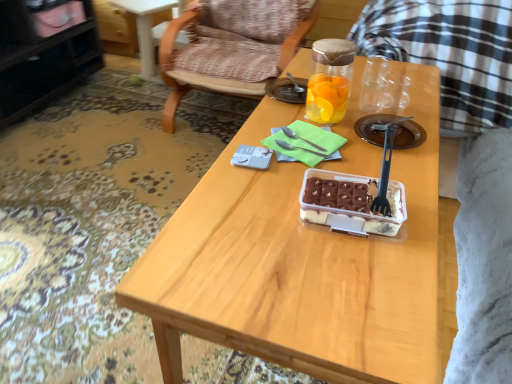
Find the location of a particular element. The width and height of the screenshot is (512, 384). vacant space positioned to the left of black plastic fork at center, the 3th fork when ordered from back to front is located at coordinates (282, 200).